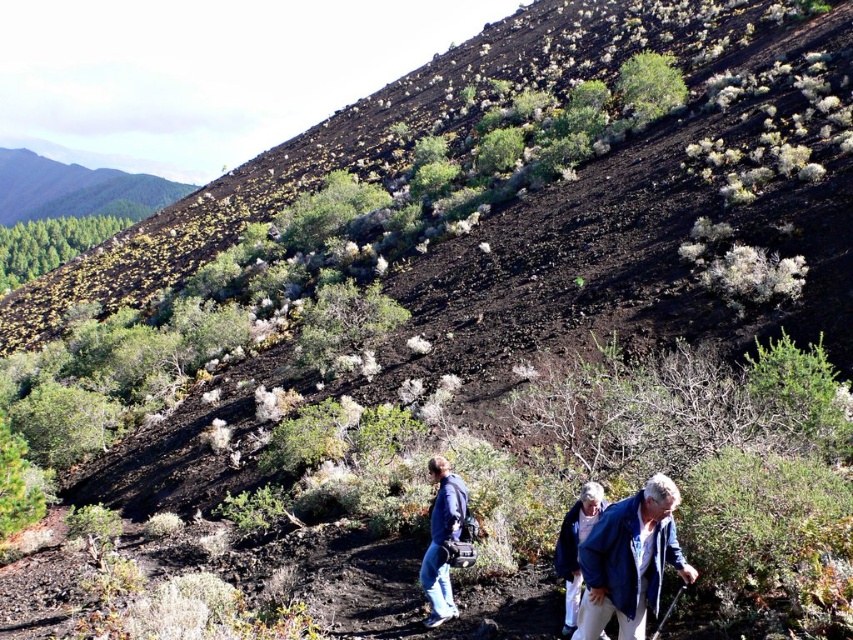
You are a hiker trying to reach the summit. You notice two landmarks marked as point coordinates in the image. Which point, point (672, 520) or point (590, 545), is closer to your current position?

Point (590, 545) is closer to your current position because it is less further to the camera than point (672, 520).